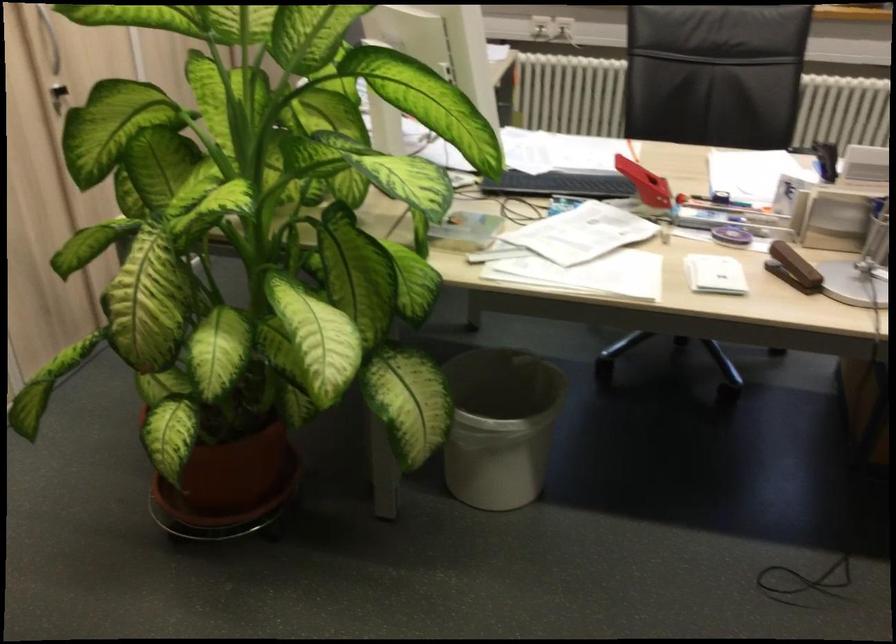
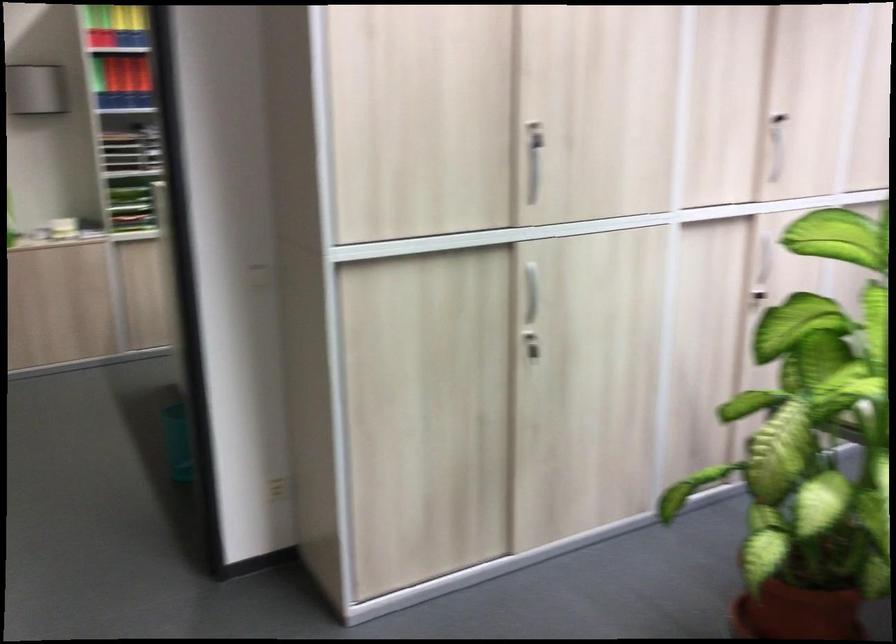
Question: The camera is either moving clockwise (left) or counter-clockwise (right) around the object. The first image is from the beginning of the video and the second image is from the end. Is the camera moving left or right when shooting the video?

Choices:
 (A) Left
 (B) Right

Answer: (B)